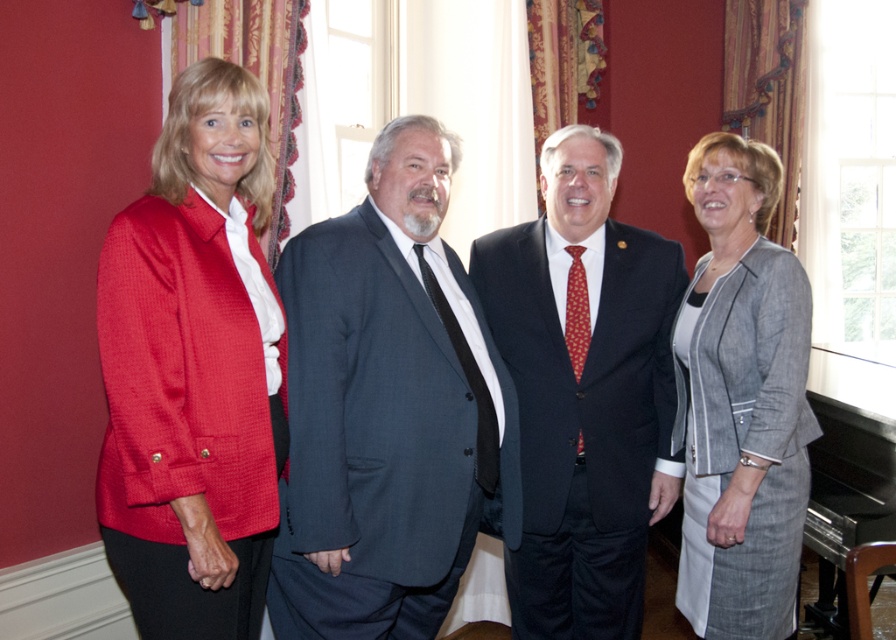
You are a photographer at a formal event. You need to capture a photo of the dark gray suit at center and the dark blue suit at center. Which one is closer to the camera?

The dark gray suit at center is in front of the dark blue suit at center, so the dark gray suit at center is closer to the camera.

You are organizing a photo shoot and need to arrange two suits in the center of the room. The dark gray suit at center and the dark blue suit at center must be placed side by side. Which suit should you place on the left side to ensure proper visibility for the camera?

The dark gray suit at center is larger in size than the dark blue suit at center, so placing the larger dark gray suit at center on the left would ensure proper visibility as it takes up more space.

You are a photographer at this event and need to arrange the dark gray suit at center and the matte red blazer at left so that both can be clearly seen in the photo. Considering their heights, which one should you place in the front to ensure the shorter one isn

The dark gray suit at center is shorter than the matte red blazer at left. To ensure both are visible, place the shorter dark gray suit at center in front so it doesn